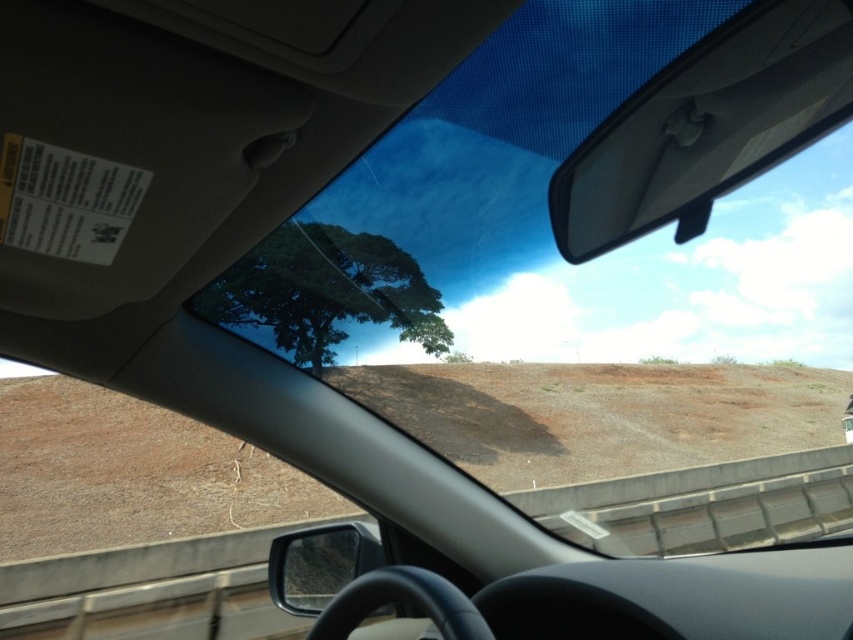
Can you confirm if green leafy tree at center is positioned above black plastic side mirror at lower center?

Correct, green leafy tree at center is located above black plastic side mirror at lower center.

Is green leafy tree at center to the right of black plastic side mirror at lower center from the viewer's perspective?

Incorrect, green leafy tree at center is not on the right side of black plastic side mirror at lower center.

Where is `green leafy tree at center`? The height and width of the screenshot is (640, 853). green leafy tree at center is located at coordinates (323, 292).

Who is more forward, (782,3) or (354,576)?

Positioned in front is point (782,3).

Does point (795, 52) lie in front of point (328, 529)?

Yes, it is in front of point (328, 529).

You are a GUI agent. You are given a task and a screenshot of the screen. Output one action in this format:
    pyautogui.click(x=<x>, y=<y>)
    Task: Click on the white plastic view mirror at upper center
    This screenshot has height=640, width=853.
    Given the screenshot: What is the action you would take?
    pyautogui.click(x=706, y=125)

Is white plastic view mirror at upper center taller than green leafy tree at center?

No, white plastic view mirror at upper center is not taller than green leafy tree at center.

What do you see at coordinates (706, 125) in the screenshot?
I see `white plastic view mirror at upper center` at bounding box center [706, 125].

The width and height of the screenshot is (853, 640). I want to click on white plastic view mirror at upper center, so click(x=706, y=125).